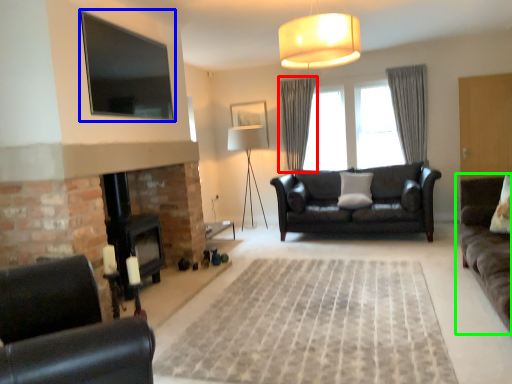
Question: Which is nearer to the curtain (highlighted by a red box)? window screen (highlighted by a blue box) or studio couch (highlighted by a green box).

Choices:
 (A) window screen
 (B) studio couch

Answer: (A)